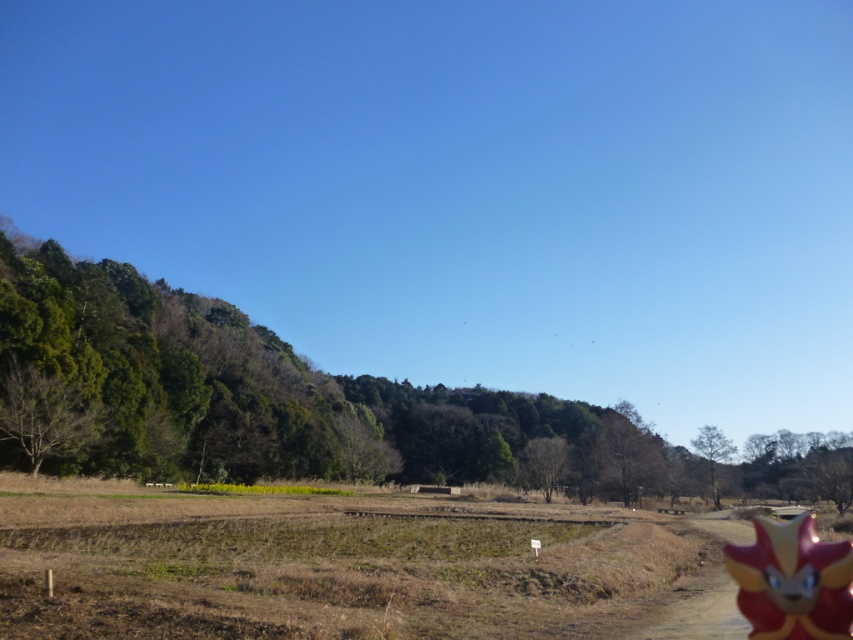
Which is more to the right, brown soil at center or shiny plastic toy at lower right?

From the viewer's perspective, shiny plastic toy at lower right appears more on the right side.

Who is higher up, brown soil at center or shiny plastic toy at lower right?

Positioned higher is shiny plastic toy at lower right.

Does point (311, 568) lie behind point (785, 609)?

That is True.

What are the coordinates of `brown soil at center` in the screenshot? It's located at (329, 564).